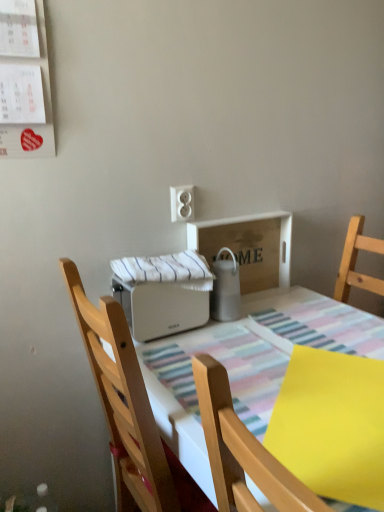
Find the location of a particular element. This screenshot has width=384, height=512. free location to the right of white matte toaster at center, arranged as the first appliance when viewed from the left is located at coordinates (242, 336).